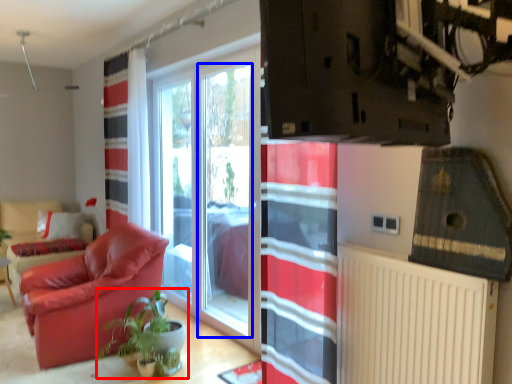
Question: Which object appears farthest to the camera in this image, houseplant (highlighted by a red box) or window screen (highlighted by a blue box)?

Choices:
 (A) houseplant
 (B) window screen

Answer: (B)